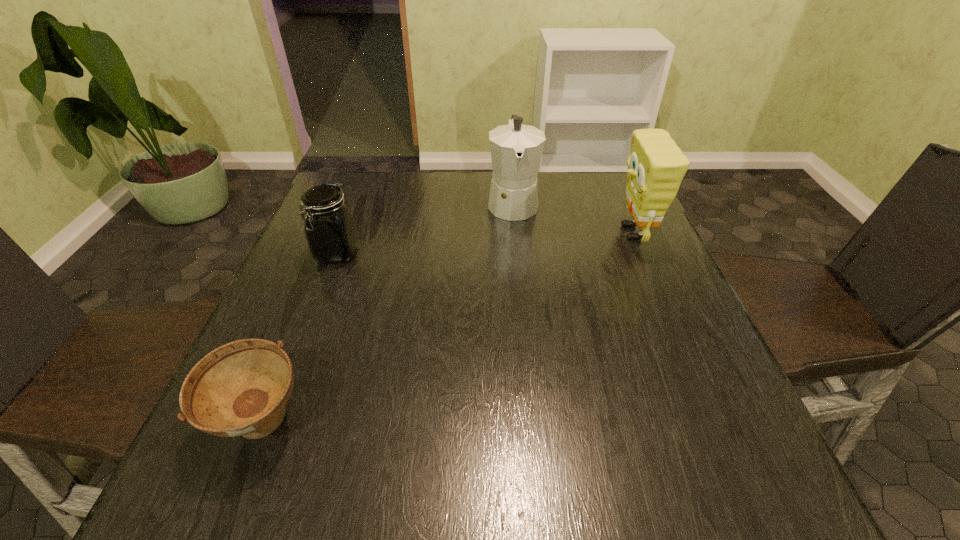
Locate an element on the screen. This screenshot has height=540, width=960. free location located 0.090m on the back of the nearest object is located at coordinates (294, 346).

I want to click on coffeepot that is positioned at the far edge, so coord(516,150).

Where is `sponge situated at the far edge`? This screenshot has width=960, height=540. sponge situated at the far edge is located at coordinates (656, 165).

At what (x,y) coordinates should I click in order to perform the action: click on object at the near edge. Please return your answer as a coordinate pair (x, y). The width and height of the screenshot is (960, 540). Looking at the image, I should click on click(239, 389).

Find the location of a particular element. jar at the left edge is located at coordinates (329, 226).

Find the location of a particular element. The width and height of the screenshot is (960, 540). soup bowl that is positioned at the left edge is located at coordinates (239, 389).

Locate an element on the screen. The image size is (960, 540). object at the right edge is located at coordinates (656, 165).

The height and width of the screenshot is (540, 960). I want to click on object that is at the near left corner, so 239,389.

Where is `object that is at the far right corner`? object that is at the far right corner is located at coordinates (656, 165).

The width and height of the screenshot is (960, 540). What are the coordinates of `vacant position at the far edge of the desktop` in the screenshot? It's located at (542, 193).